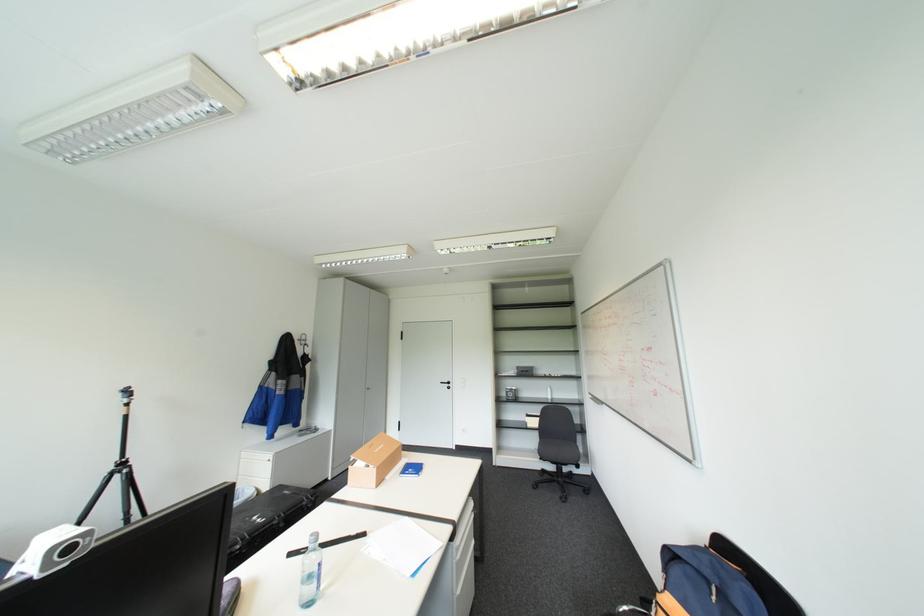
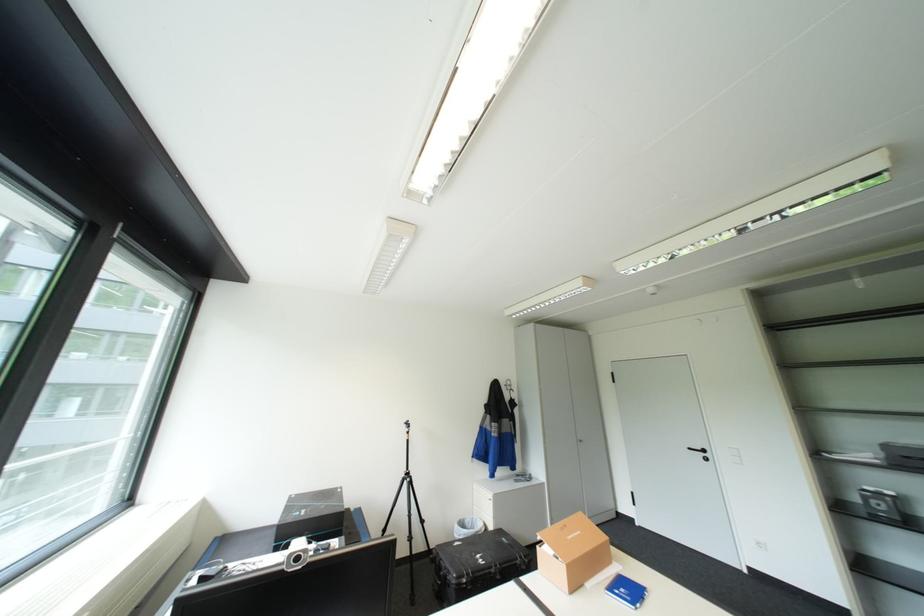
Where in the second image is the point corresponding to pixel 129 516 from the first image?

(416, 512)